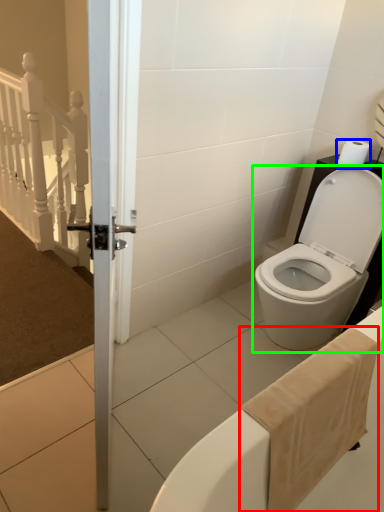
Question: Considering the real-world distances, which object is closest to bath towel (highlighted by a red box)? toilet paper (highlighted by a blue box) or toilet (highlighted by a green box).

Choices:
 (A) toilet paper
 (B) toilet

Answer: (B)